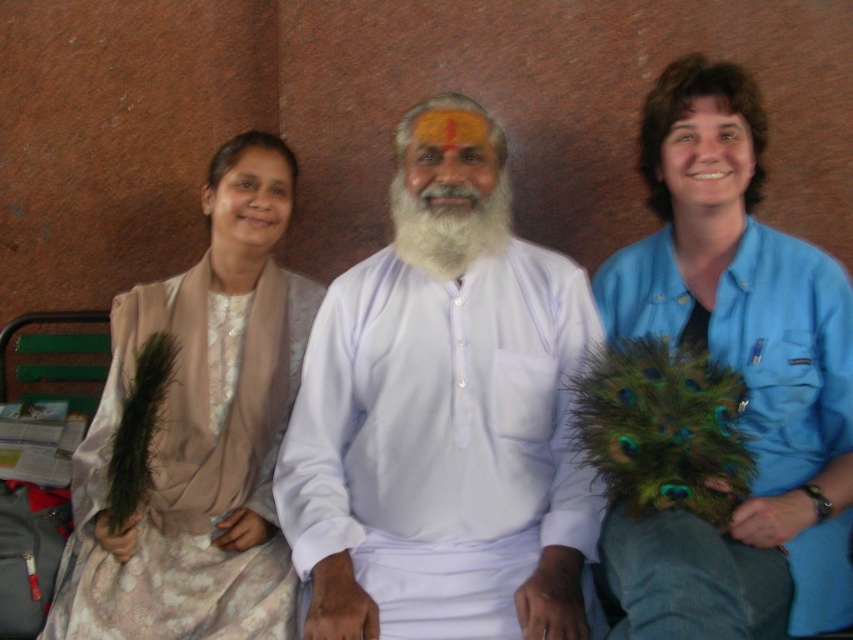
Can you confirm if white matte shirt at center is wider than matte beige scarf at left?

Yes, white matte shirt at center is wider than matte beige scarf at left.

Is point (347, 352) positioned after point (309, 317)?

No, it is in front of (309, 317).

Locate an element on the screen. white matte shirt at center is located at coordinates (442, 410).

What do you see at coordinates (194, 432) in the screenshot?
I see `matte beige scarf at left` at bounding box center [194, 432].

Can you confirm if matte beige scarf at left is taller than green feathered mask at right?

Yes.

Between point (120, 621) and point (645, 285), which one is positioned in front?

Point (120, 621)

Find the location of a particular element. This screenshot has height=640, width=853. matte beige scarf at left is located at coordinates (194, 432).

Between matte beige scarf at left and whitewoollybeard at center, which one has more height?

matte beige scarf at left is taller.

Is matte beige scarf at left taller than whitewoollybeard at center?

Indeed, matte beige scarf at left has a greater height compared to whitewoollybeard at center.

This screenshot has width=853, height=640. What do you see at coordinates (194, 432) in the screenshot?
I see `matte beige scarf at left` at bounding box center [194, 432].

Find the location of a particular element. This screenshot has height=640, width=853. matte beige scarf at left is located at coordinates (194, 432).